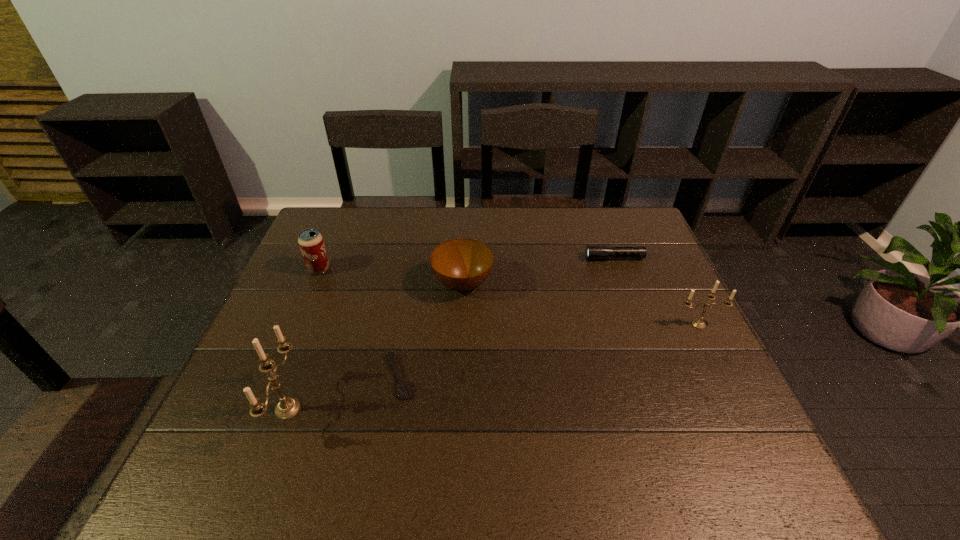
Find the location of `vacant area at the far left corner of the desktop`. vacant area at the far left corner of the desktop is located at coordinates (x=320, y=232).

I want to click on free region at the near left corner of the desktop, so click(x=271, y=400).

Where is `vacant area at the far right corner of the desktop`? The image size is (960, 540). vacant area at the far right corner of the desktop is located at coordinates (595, 208).

In the image, there is a desktop. Find the location of `vacant space at the near right corner`. vacant space at the near right corner is located at coordinates (681, 436).

Image resolution: width=960 pixels, height=540 pixels. I want to click on free space that is in between the beer can and the left candle, so click(303, 339).

Where is `vacant area that lies between the bowl and the third tallest object`? This screenshot has height=540, width=960. vacant area that lies between the bowl and the third tallest object is located at coordinates (391, 276).

Identify the location of free space between the fifth object from left to right and the rightmost object. (657, 291).

At what (x,y) coordinates should I click in order to perform the action: click on free area in between the second object from right to left and the tallest object. Please return your answer as a coordinate pair (x, y). The height and width of the screenshot is (540, 960). Looking at the image, I should click on (451, 333).

At what (x,y) coordinates should I click in order to perform the action: click on free space that is in between the third object from left to right and the beer can. Please return your answer as a coordinate pair (x, y). Looking at the image, I should click on (360, 323).

At what (x,y) coordinates should I click in order to perform the action: click on vacant space that is in between the third shortest object and the shortest object. Please return your answer as a coordinate pair (x, y). The image size is (960, 540). Looking at the image, I should click on (431, 330).